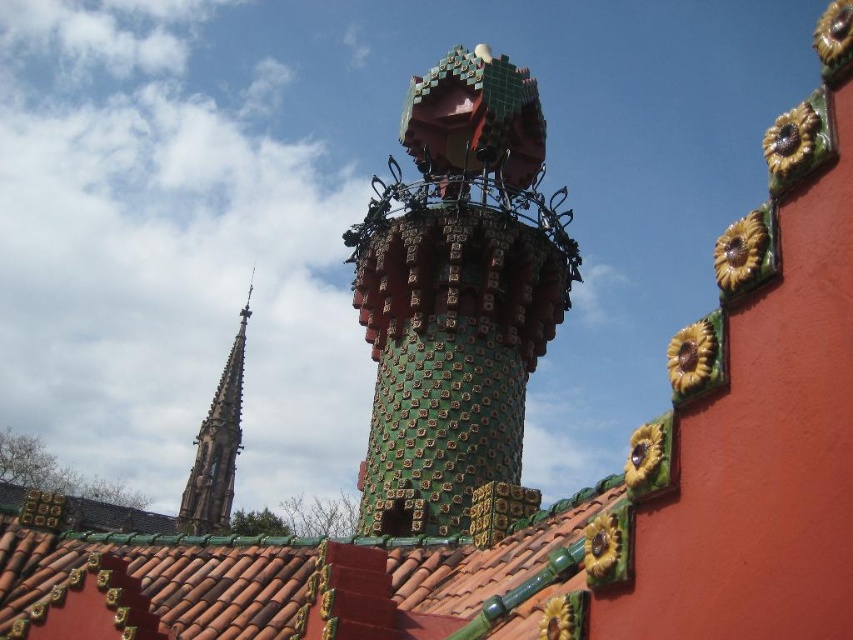
Which of these two, green mosaic tower at center or green glazed tiles at center, stands taller?

Standing taller between the two is green mosaic tower at center.

Which is more to the left, green mosaic tower at center or green glazed tiles at center?

From the viewer's perspective, green glazed tiles at center appears more on the left side.

Identify the location of green mosaic tower at center. The width and height of the screenshot is (853, 640). (457, 301).

Who is positioned more to the left, green glazed tiles at center or green mosaic spire at upper left?

From the viewer's perspective, green mosaic spire at upper left appears more on the left side.

The height and width of the screenshot is (640, 853). I want to click on green glazed tiles at center, so click(323, 573).

Between point (415, 582) and point (190, 493), which one is positioned behind?

Positioned behind is point (190, 493).

The width and height of the screenshot is (853, 640). I want to click on green glazed tiles at center, so click(x=323, y=573).

From the picture: Does green mosaic tower at center lie behind green mosaic spire at upper left?

No, it is in front of green mosaic spire at upper left.

Is green mosaic tower at center below green mosaic spire at upper left?

Actually, green mosaic tower at center is above green mosaic spire at upper left.

Measure the distance between point (466, 509) and camera.

Point (466, 509) and camera are 152.70 feet apart.

The height and width of the screenshot is (640, 853). Identify the location of green mosaic tower at center. (457, 301).